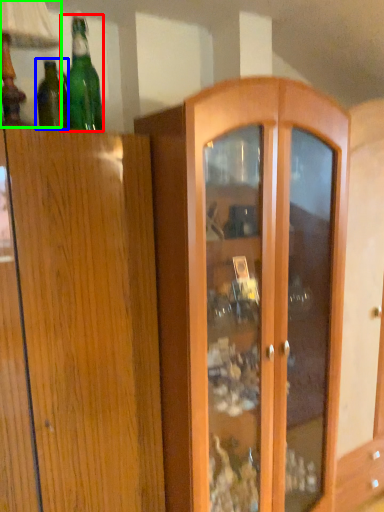
Question: Estimate the real-world distances between objects in this image. Which object is closer to bottle (highlighted by a red box), bottle (highlighted by a blue box) or table lamp (highlighted by a green box)?

Choices:
 (A) bottle
 (B) table lamp

Answer: (A)